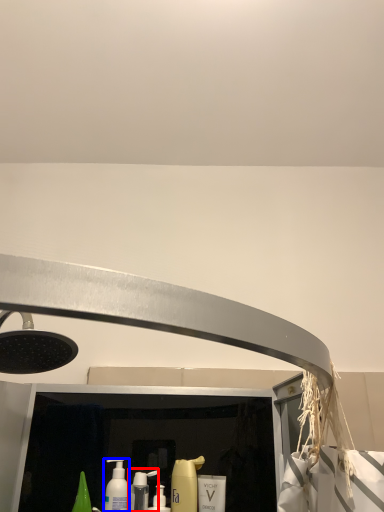
Question: Which object appears farthest to the camera in this image, cleaning product (highlighted by a red box) or mouthwash (highlighted by a blue box)?

Choices:
 (A) cleaning product
 (B) mouthwash

Answer: (A)